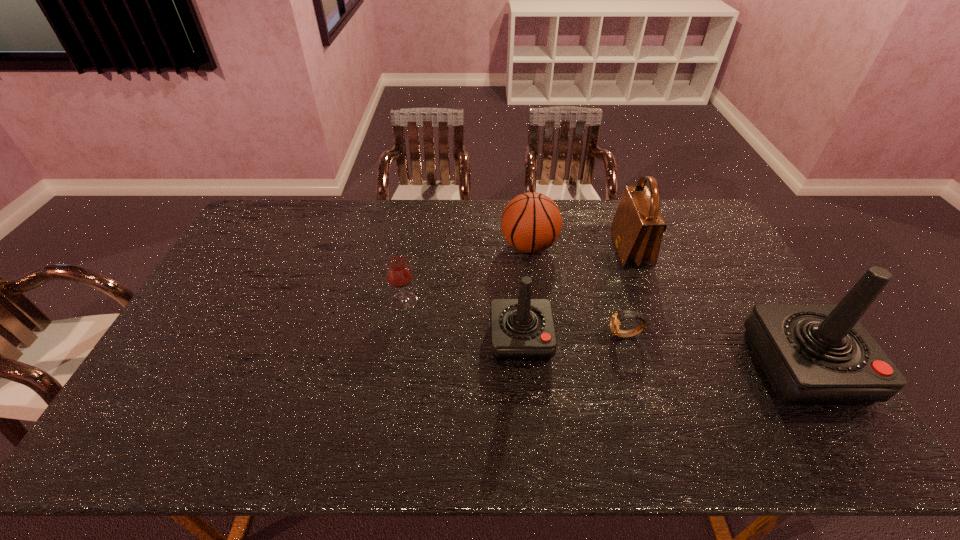
This screenshot has width=960, height=540. I want to click on free space located on the front-facing side of the shorter joystick, so click(x=525, y=390).

The width and height of the screenshot is (960, 540). Identify the location of vacant space located 0.080m on the front flap of the shoulder bag. (591, 249).

Where is `free space located 0.330m on the front flap of the shoulder bag`? free space located 0.330m on the front flap of the shoulder bag is located at coordinates (518, 249).

You are a GUI agent. You are given a task and a screenshot of the screen. Output one action in this format:
    pyautogui.click(x=<x>, y=<y>)
    Task: Click on the vacant space located 0.120m on the front flap of the shoulder bag
    The width and height of the screenshot is (960, 540).
    Given the screenshot: What is the action you would take?
    pyautogui.click(x=580, y=249)

At what (x,y) coordinates should I click in order to perform the action: click on free space located 0.310m on the side where the inflation valve is located. Please return your answer as a coordinate pair (x, y). Looking at the image, I should click on (411, 246).

At what (x,y) coordinates should I click in order to perform the action: click on free space located on the side where the inflation valve is located. Please return your answer as a coordinate pair (x, y). Looking at the image, I should click on (417, 246).

The image size is (960, 540). I want to click on vacant space situated 0.310m on the side where the inflation valve is located, so click(x=411, y=246).

The image size is (960, 540). Find the location of `free region located 0.160m on the back of the fifth tallest object`. free region located 0.160m on the back of the fifth tallest object is located at coordinates pos(412,258).

Where is `vacant region located on the face of the shortest object`? The width and height of the screenshot is (960, 540). vacant region located on the face of the shortest object is located at coordinates (472, 335).

The width and height of the screenshot is (960, 540). Find the location of `free region located on the face of the shortest object`. free region located on the face of the shortest object is located at coordinates (504, 335).